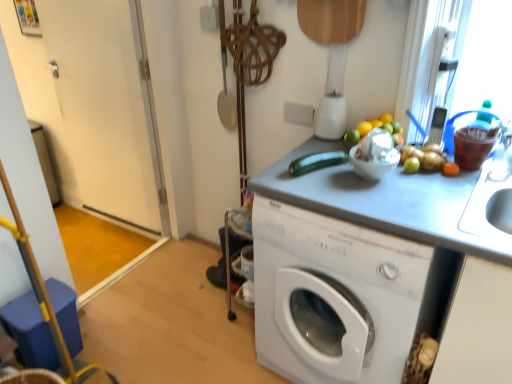
At what (x,y) coordinates should I click in order to perform the action: click on free space that is in between white glossy bowl at center and green matte zucchini at center. Please return your answer as a coordinate pair (x, y). This screenshot has height=384, width=512. Looking at the image, I should click on (344, 185).